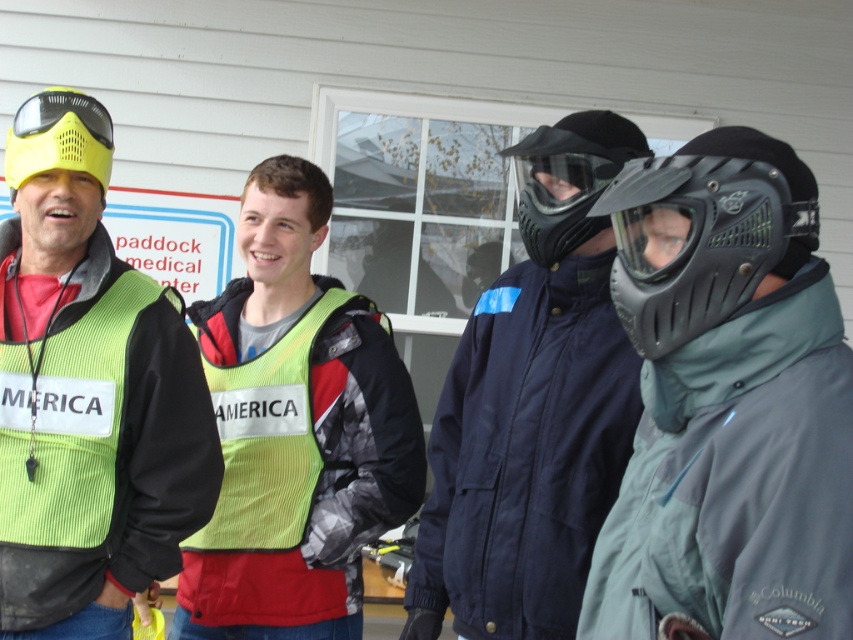
Question: Does black matte helmet at right appear under black matte mask at center?

Choices:
 (A) yes
 (B) no

Answer: (A)

Question: Which object is closer to the camera taking this photo?

Choices:
 (A) yellow matte/glossy goggles at upper left
 (B) matte yellow helmet at upper left

Answer: (B)

Question: Is navy blue jacket at center to the right of matte yellow helmet at upper left from the viewer's perspective?

Choices:
 (A) yes
 (B) no

Answer: (A)

Question: Among these points, which one is nearest to the camera?

Choices:
 (A) (27, 168)
 (B) (47, 272)
 (C) (547, 589)

Answer: (C)

Question: Which point is closer to the camera?

Choices:
 (A) matte yellow helmet at upper left
 (B) matte yellow safety vest at left
 (C) black matte mask at center

Answer: (C)

Question: Does navy blue jacket at center appear on the left side of yellow reflective vest at center?

Choices:
 (A) yes
 (B) no

Answer: (B)